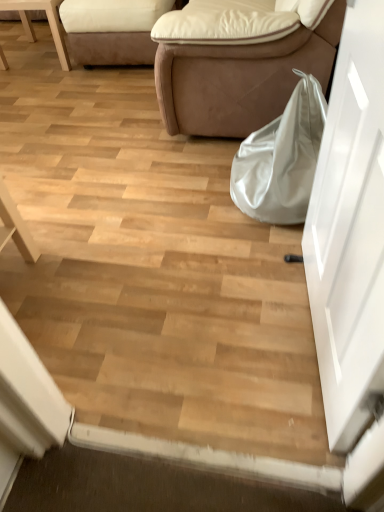
Image resolution: width=384 pixels, height=512 pixels. Find the location of `free space behind white glossy door at right`. free space behind white glossy door at right is located at coordinates (241, 249).